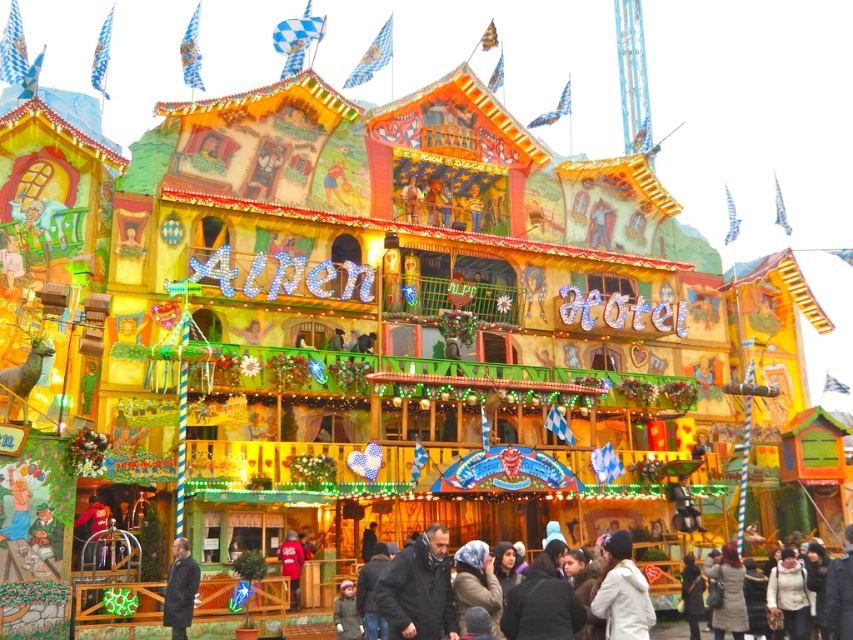
You are a fashion designer observing a crowd at a Bavarian festival. You notice a black matte jacket at center and a dark gray coat at lower left. Which clothing item is wider?

The black matte jacket at center is wider than the dark gray coat at lower left according to their widths.

You are attending a festival at the Alten Hotel and notice two items of clothing. The black matte jacket at center and the dark gray coat at lower left. Which item of clothing is larger?

The black matte jacket at center is bigger than the dark gray coat at lower left.

You are a photographer at the fairground and want to capture both the black matte jacket at center and the dark gray coat at lower left in a single shot. Which clothing item will appear larger in your photo?

The black matte jacket at center will appear larger in the photo because it is closer to the viewer than the dark gray coat at lower left.